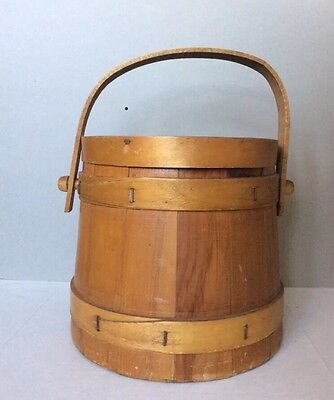
You are a GUI agent. You are given a task and a screenshot of the screen. Output one action in this format:
    pyautogui.click(x=<x>, y=<y>)
    Task: Click on the medium brown hardwood surface
    This screenshot has width=334, height=400.
    Given the screenshot: What is the action you would take?
    pyautogui.click(x=212, y=271)